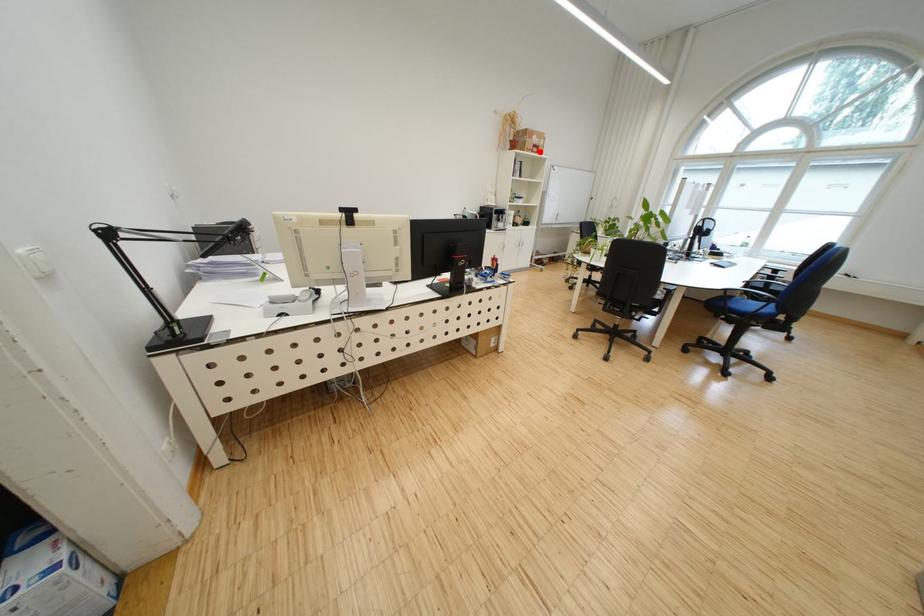
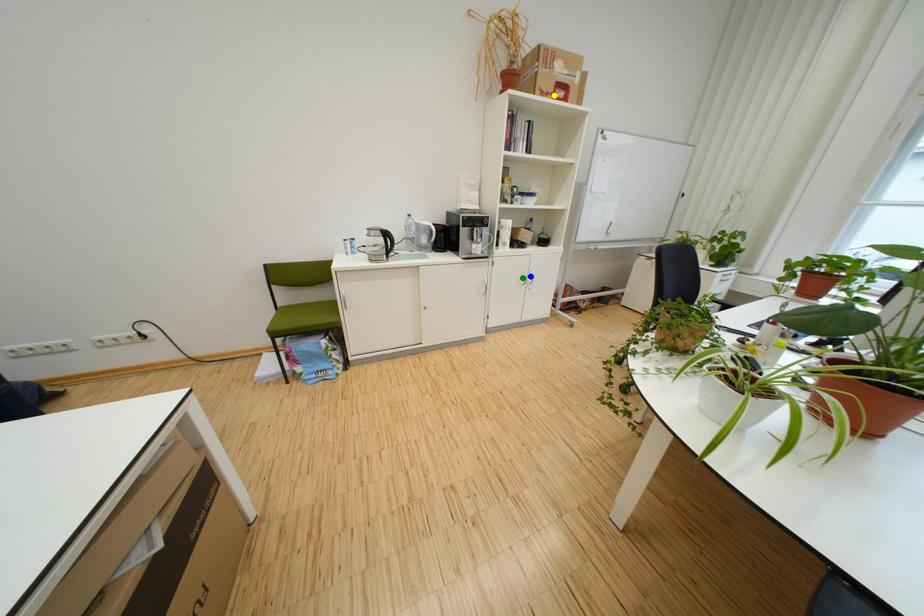
Question: I am providing you with two images of the same scene from different viewpoints. A red point is marked on the first image. You are given multiple points on the second image. Which point in image 2 is actually the same real-world point as the red point in image 1?

Choices:
 (A) green point
 (B) blue point
 (C) yellow point

Answer: (C)